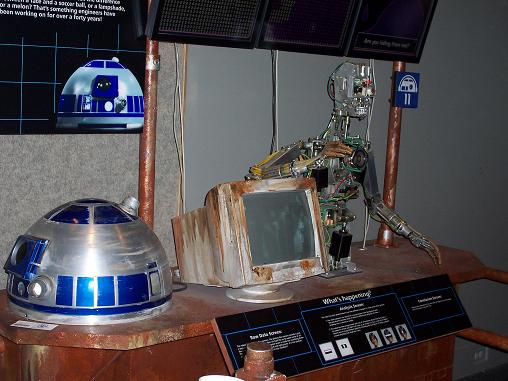
Locate an element on the screen. The width and height of the screenshot is (508, 381). computer monitor is located at coordinates (264, 214).